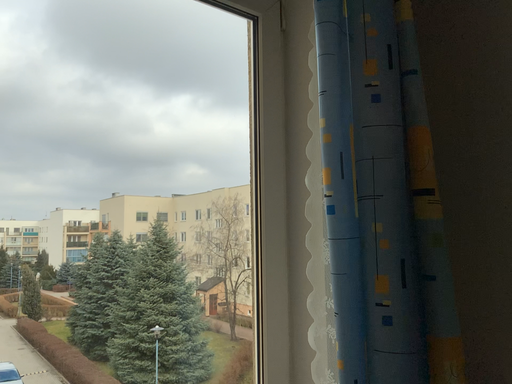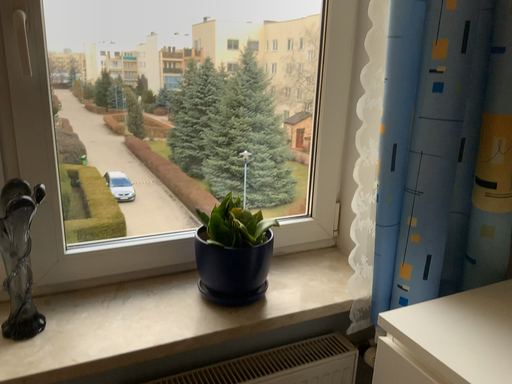
Question: How did the camera likely rotate when shooting the video?

Choices:
 (A) rotated right
 (B) rotated left

Answer: (B)